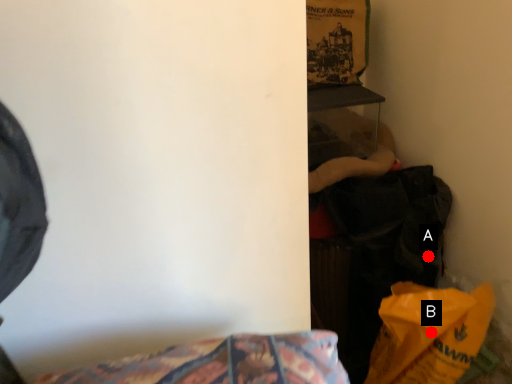
Question: Two points are circled on the image, labeled by A and B beside each circle. Which point appears farthest from the camera in this image?

Choices:
 (A) A is further
 (B) B is further

Answer: (A)